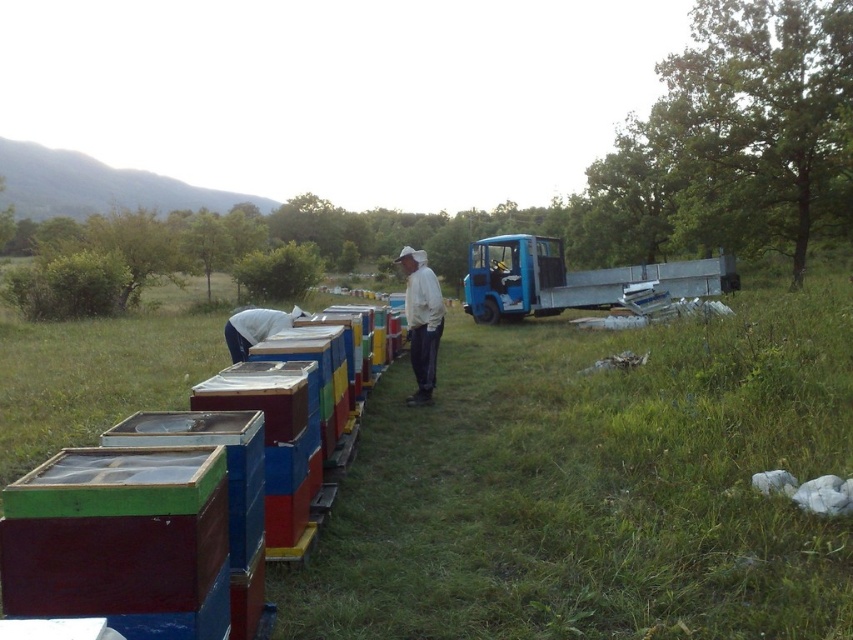
Question: Which is farther from the white matte jacket at center?

Choices:
 (A) multicolored painted beehive at center
 (B) white fabric at center

Answer: (A)

Question: Is white matte jacket at center thinner than white fabric at center?

Choices:
 (A) no
 (B) yes

Answer: (B)

Question: Can you confirm if white matte jacket at center is smaller than white fabric at center?

Choices:
 (A) no
 (B) yes

Answer: (B)

Question: Does white matte jacket at center have a smaller size compared to white fabric at center?

Choices:
 (A) no
 (B) yes

Answer: (B)

Question: Which point is closer to the camera taking this photo?

Choices:
 (A) (16, 400)
 (B) (410, 246)

Answer: (A)

Question: Which object is positioned closest to the multicolored painted beehive at center?

Choices:
 (A) white matte jacket at center
 (B) white fabric at center

Answer: (B)